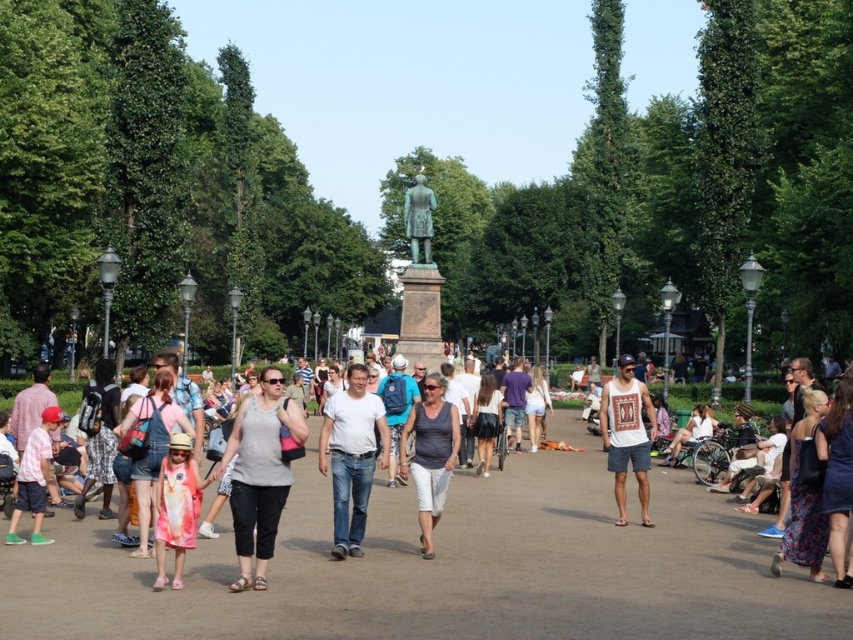
Which is in front, point (140, 488) or point (490, 394)?

Point (140, 488)

In the scene shown: Is the position of pink fabric dress at center more distant than that of white cotton dress at center?

→ No.

Is point (140, 518) positioned in front of point (486, 456)?

Yes, point (140, 518) is closer to viewer.

Locate an element on the screen. The width and height of the screenshot is (853, 640). pink fabric dress at center is located at coordinates (152, 449).

Which of these two, gray cotton tank top at center or white tank top at center, stands shorter?

With less height is white tank top at center.

Is gray cotton tank top at center thinner than white tank top at center?

No, gray cotton tank top at center is not thinner than white tank top at center.

Locate an element on the screen. The height and width of the screenshot is (640, 853). gray cotton tank top at center is located at coordinates (259, 474).

In the scene shown: Which is more to the left, gray cotton tank top at center or pink fabric dress at center?

Positioned to the left is pink fabric dress at center.

Is gray cotton tank top at center to the left of pink fabric dress at center from the viewer's perspective?

In fact, gray cotton tank top at center is to the right of pink fabric dress at center.

Locate an element on the screen. This screenshot has width=853, height=640. gray cotton tank top at center is located at coordinates (259, 474).